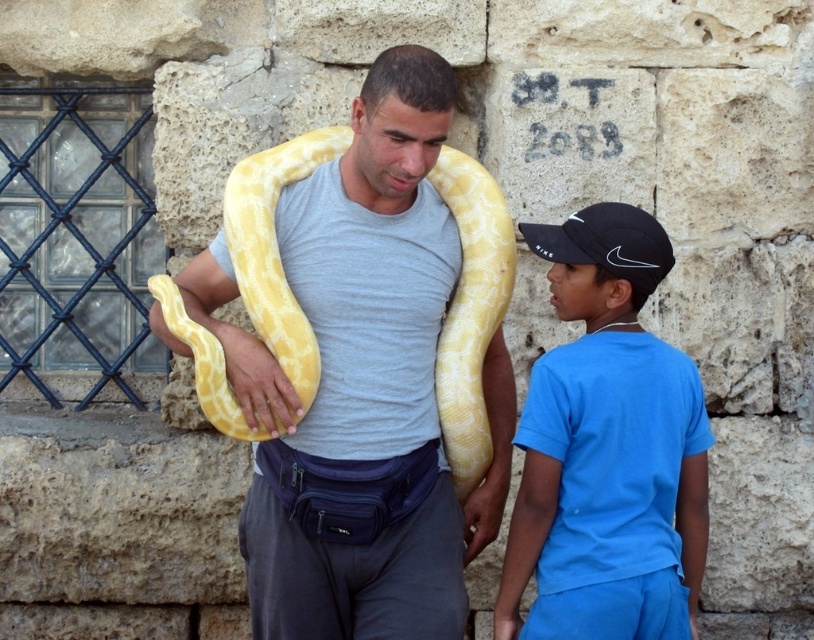
Who is more forward, (598, 404) or (618, 324)?

Point (598, 404)

Who is positioned more to the right, blue cotton shirt at right or matte blue neck at upper center?

matte blue neck at upper center

Is point (596, 205) positioned before point (619, 316)?

Yes, it is.

The image size is (814, 640). Identify the location of blue cotton shirt at right. (607, 472).

Is the position of yellow matte snake at center more distant than that of matte blue neck at upper center?

No, it is in front of matte blue neck at upper center.

Is point (355, 193) behind point (593, 320)?

Yes.

Between point (387, 141) and point (633, 324), which one is positioned in front?

Point (387, 141) is in front.

Find the location of a particular element. yellow matte snake at center is located at coordinates (381, 164).

Does matte yellow snake at center appear under matte blue neck at upper center?

Indeed, matte yellow snake at center is positioned under matte blue neck at upper center.

Is point (274, 426) in front of point (624, 321)?

Yes.

Identify the location of matte yellow snake at center. 357,419.